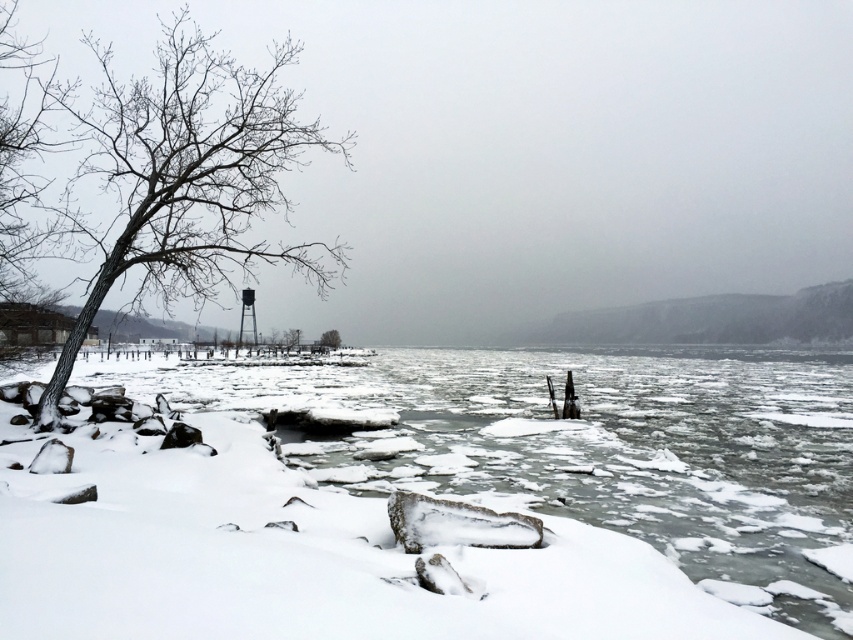
Describe the element at coordinates (187, 177) in the screenshot. I see `bare wood tree at left` at that location.

Does point (125, 189) come in front of point (331, 337)?

Yes, point (125, 189) is closer to viewer.

Which is behind, point (281, 108) or point (325, 332)?

The point (325, 332) is behind.

At what (x,y) coordinates should I click in order to perform the action: click on bare wood tree at left. Please return your answer as a coordinate pair (x, y). Image resolution: width=853 pixels, height=640 pixels. Looking at the image, I should click on (187, 177).